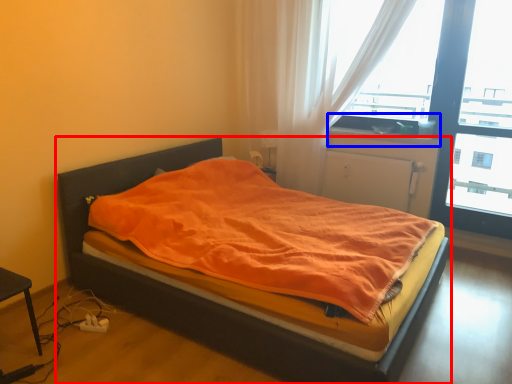
Question: Among these objects, which one is farthest to the camera, bed (highlighted by a red box) or window sill (highlighted by a blue box)?

Choices:
 (A) bed
 (B) window sill

Answer: (B)